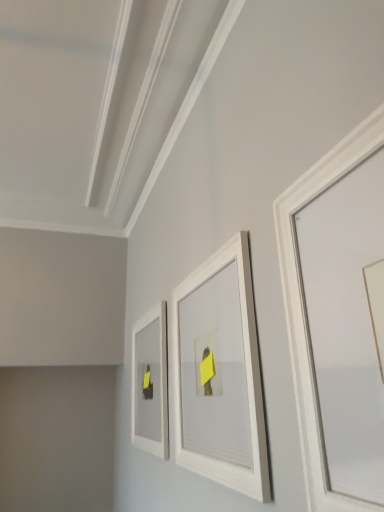
Question: Is white matte picture frame at center, arranged as the 2th picture frame when viewed from the left, far from white matte picture frame at center-left, the 1th picture frame positioned from the back?

Choices:
 (A) yes
 (B) no

Answer: (B)

Question: Is white matte picture frame at center-left, the 1th picture frame positioned from the back, surrounded by white matte picture frame at center, arranged as the 2th picture frame when viewed from the left?

Choices:
 (A) yes
 (B) no

Answer: (B)

Question: Does white matte picture frame at center, the second picture frame positioned from the front, have a lesser height compared to white matte picture frame at center-left, the 1th picture frame positioned from the back?

Choices:
 (A) no
 (B) yes

Answer: (A)

Question: From a real-world perspective, does white matte picture frame at center, placed as the 2th picture frame when sorted from right to left, stand above white matte picture frame at center-left, marked as the 3th picture frame in a right-to-left arrangement?

Choices:
 (A) no
 (B) yes

Answer: (B)

Question: Can you confirm if white matte picture frame at center, arranged as the 2th picture frame when viewed from the left, is bigger than white matte picture frame at center-left, which is counted as the 1th picture frame, starting from the left?

Choices:
 (A) yes
 (B) no

Answer: (A)

Question: Considering the positions of white matte picture frame at center, the second picture frame positioned from the front, and white matte picture frame at center-left, the 1th picture frame positioned from the back, in the image, is white matte picture frame at center, the second picture frame positioned from the front, taller or shorter than white matte picture frame at center-left, the 1th picture frame positioned from the back,?

Choices:
 (A) tall
 (B) short

Answer: (A)

Question: Looking at the image, does white matte picture frame at center, placed as the 2th picture frame when sorted from right to left, seem bigger or smaller compared to white matte picture frame at center-left, which is counted as the 1th picture frame, starting from the left?

Choices:
 (A) small
 (B) big

Answer: (B)

Question: In the image, is white matte picture frame at center, which is the 2th picture frame in back-to-front order, positioned in front of or behind white matte picture frame at center-left, which is counted as the 1th picture frame, starting from the left?

Choices:
 (A) front
 (B) behind

Answer: (A)

Question: Is white matte picture frame at center, the second picture frame positioned from the front, to the left or to the right of white matte picture frame at center-left, the 1th picture frame positioned from the back, in the image?

Choices:
 (A) left
 (B) right

Answer: (B)

Question: In terms of size, does white matte picture frame at upper right, which is the third picture frame from left to right, appear bigger or smaller than white matte picture frame at center-left, acting as the third picture frame starting from the front?

Choices:
 (A) small
 (B) big

Answer: (A)

Question: Looking at their shapes, would you say white matte picture frame at upper right, which appears as the first picture frame when viewed from the front, is wider or thinner than white matte picture frame at center-left, marked as the 3th picture frame in a right-to-left arrangement?

Choices:
 (A) thin
 (B) wide

Answer: (A)

Question: Visually, is white matte picture frame at upper right, which appears as the first picture frame when viewed from the front, positioned to the left or to the right of white matte picture frame at center-left, marked as the 3th picture frame in a right-to-left arrangement?

Choices:
 (A) left
 (B) right

Answer: (B)

Question: From the image's perspective, is white matte picture frame at upper right, which appears as the first picture frame when viewed from the front, above or below white matte picture frame at center-left, the 1th picture frame positioned from the back?

Choices:
 (A) below
 (B) above

Answer: (B)

Question: Relative to white matte picture frame at center, which is the 2th picture frame in back-to-front order, is white matte picture frame at upper right, which is the third picture frame from left to right, in front or behind?

Choices:
 (A) front
 (B) behind

Answer: (A)

Question: Considering the positions of white matte picture frame at upper right, the third picture frame viewed from the back, and white matte picture frame at center, which is the 2th picture frame in back-to-front order, in the image, is white matte picture frame at upper right, the third picture frame viewed from the back, taller or shorter than white matte picture frame at center, which is the 2th picture frame in back-to-front order,?

Choices:
 (A) tall
 (B) short

Answer: (B)